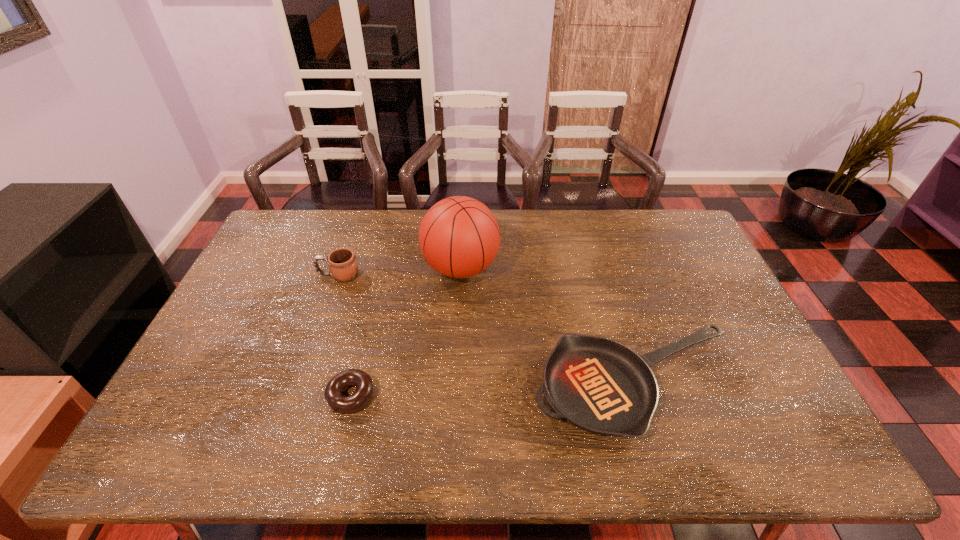
The height and width of the screenshot is (540, 960). I want to click on the tallest object, so click(459, 237).

Where is `the second object from right to left`? Image resolution: width=960 pixels, height=540 pixels. the second object from right to left is located at coordinates (459, 237).

Where is `the third shortest object`? The height and width of the screenshot is (540, 960). the third shortest object is located at coordinates (342, 263).

Identify the location of mug. This screenshot has height=540, width=960. (342, 263).

You are a GUI agent. You are given a task and a screenshot of the screen. Output one action in this format:
    pyautogui.click(x=<x>, y=<y>)
    Task: Click on the rightmost object
    The height and width of the screenshot is (540, 960).
    Given the screenshot: What is the action you would take?
    pyautogui.click(x=601, y=386)

In order to click on doughnut in this screenshot , I will do `click(338, 402)`.

Where is `vacant space located 0.350m on the right of the third object from left to right`? The height and width of the screenshot is (540, 960). vacant space located 0.350m on the right of the third object from left to right is located at coordinates (604, 268).

This screenshot has height=540, width=960. I want to click on vacant space located on the side of the second tallest object with the handle, so click(262, 275).

You are a GUI agent. You are given a task and a screenshot of the screen. Output one action in this format:
    pyautogui.click(x=<x>, y=<y>)
    Task: Click on the vacant space located on the side of the second tallest object with the handle
    
    Given the screenshot: What is the action you would take?
    pyautogui.click(x=275, y=275)

Locate an element on the screen. Image resolution: width=960 pixels, height=540 pixels. free location located on the side of the second tallest object with the handle is located at coordinates (268, 275).